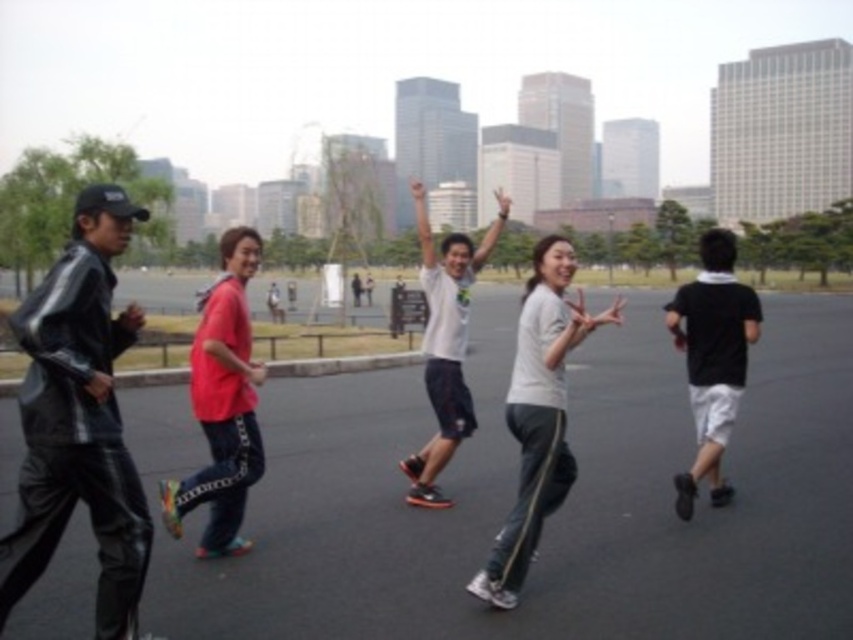
You are a photographer trying to capture a group photo of the shiny black jacket at left and the white matte shirt at center. Since you want both subjects to appear equally tall in the photo, which subject should you position closer to the camera?

The shiny black jacket at left is shorter than the white matte shirt at center, so to make them appear equally tall in the photo, position the shiny black jacket at left closer to the camera.

Consider the image. You are a photographer standing at the edge of the park. You want to capture a photo where the shiny black jacket at left and the white matte shirt at center are both visible. Based on their positions, which subject will appear lower in the photo?

The shiny black jacket at left appears lower in the photo because it is positioned below the white matte shirt at center.

You are a photographer standing at the edge of the plaza. You want to take a photo of the red matte skateboard at center from your current position. The camera you are using has a maximum focus range of 5 meters. Will the camera be able to capture the skateboard clearly?

The red matte skateboard at center and camera are 4.91 meters apart, so the camera can focus on the skateboard clearly since the distance is within the 5 meters range.